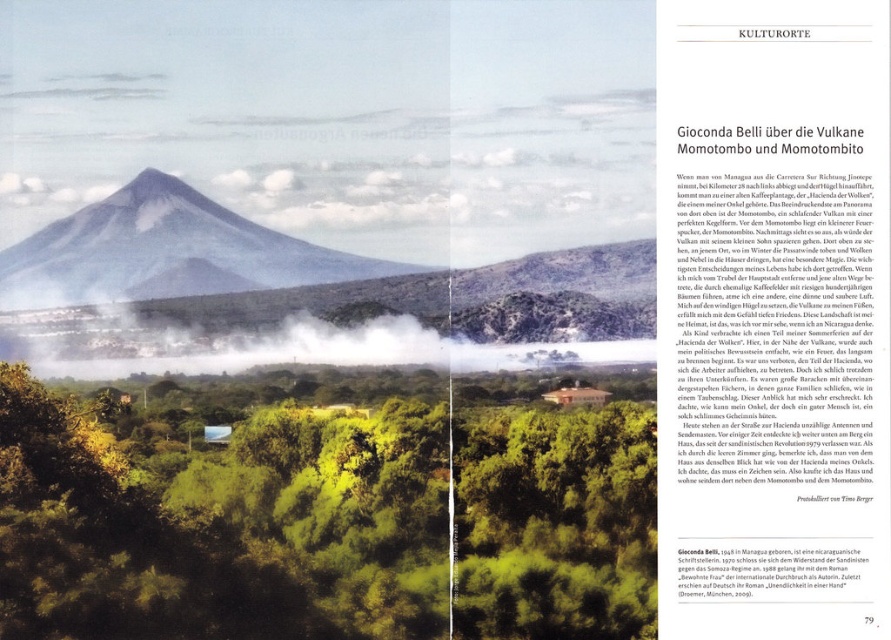
You are a photographer planning to take a photo of the green leafy tree at center and the gray volcanic mountain at center in the background. Given that your camera has a depth of field that can focus on objects within 10 meters of each other, will both subjects be in focus?

The distance between the green leafy tree at center and the gray volcanic mountain at center is 13.44 meters, which exceeds the 10 meters depth of field range. Therefore, both subjects cannot be in focus simultaneously.

You are designing a poster for a travel agency and have this image as a reference. You need to include both the green leafy tree at center and the black paper at lower center. Which object should you make larger in your design to maintain the original scene proportions?

The green leafy tree at center should be made larger than the black paper at lower center to maintain the original scene proportions since it is bigger in the original image.